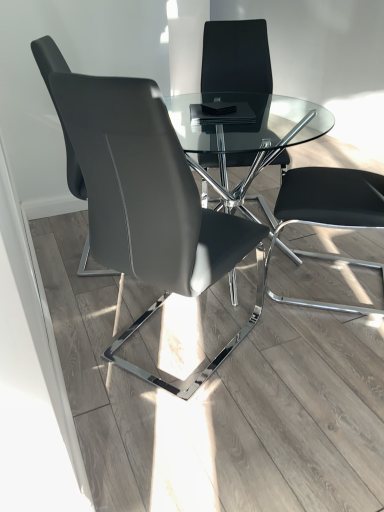
At what (x,y) coordinates should I click in order to perform the action: click on free point to the left of matte black chair at left, the 2th chair viewed from the front. Please return your answer as a coordinate pair (x, y). This screenshot has height=512, width=384. Looking at the image, I should click on (58, 238).